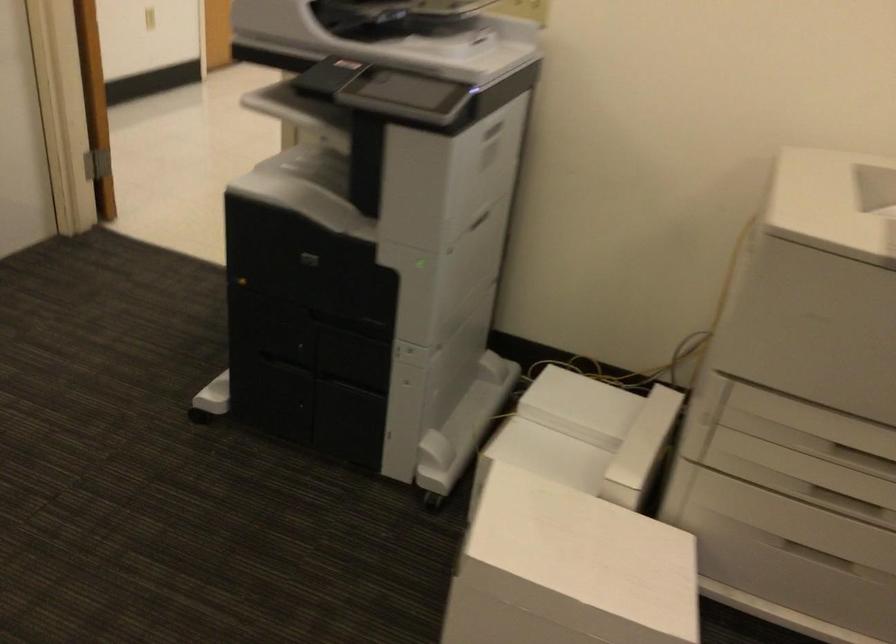
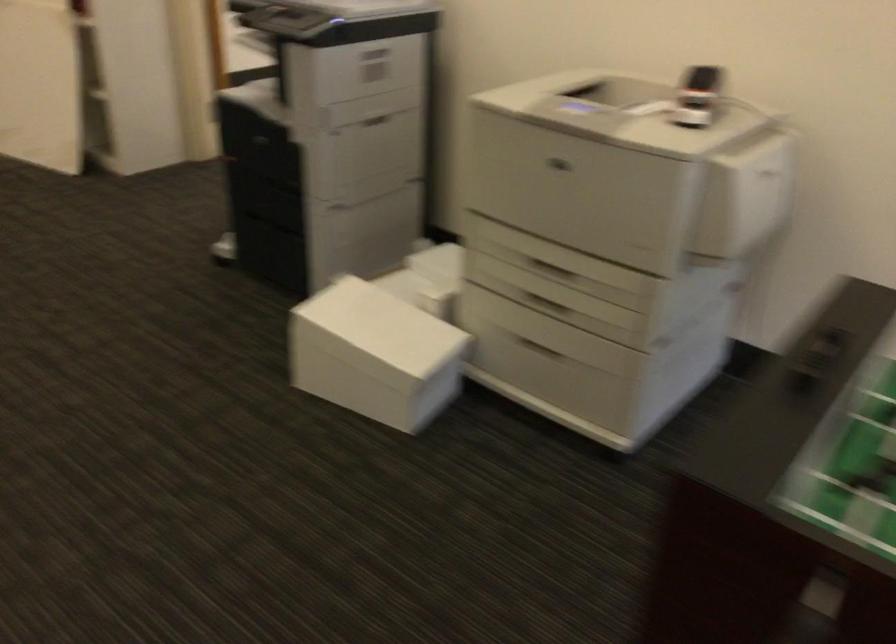
In the second image, find the point that corresponds to (x=807, y=551) in the first image.

(537, 346)